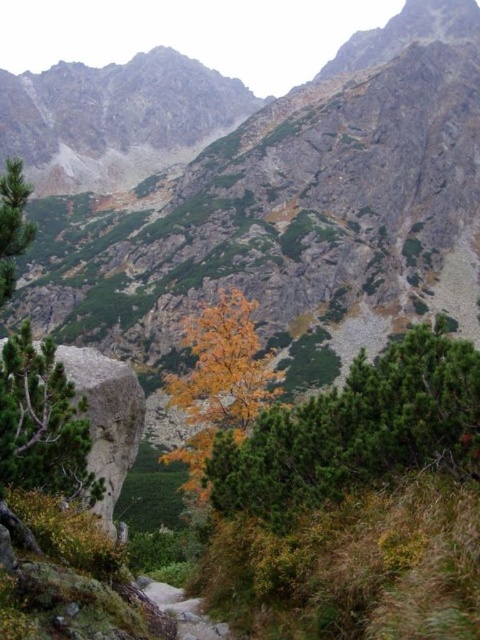
Between point (200, 445) and point (24, 444), which one is positioned behind?

The point (200, 445) is more distant.

Is point (222, 420) behind point (51, 433)?

Yes, it is.

Locate an element on the screen. Image resolution: width=480 pixels, height=640 pixels. golden leafy tree at center is located at coordinates (219, 381).

Who is taller, green needle-like tree at center or golden leafy tree at center?

Standing taller between the two is golden leafy tree at center.

Between green needle-like tree at center and golden leafy tree at center, which one appears on the left side from the viewer's perspective?

From the viewer's perspective, golden leafy tree at center appears more on the left side.

This screenshot has width=480, height=640. What are the coordinates of `green needle-like tree at center` in the screenshot? It's located at (357, 429).

Locate an element on the screen. green needle-like tree at center is located at coordinates [357, 429].

Which is below, green needle-like tree at center or green matte tree at center-left?

green needle-like tree at center

Which is more to the left, green needle-like tree at center or green matte tree at center-left?

green matte tree at center-left is more to the left.

Find the location of a particular element. Image resolution: width=480 pixels, height=640 pixels. green needle-like tree at center is located at coordinates (357, 429).